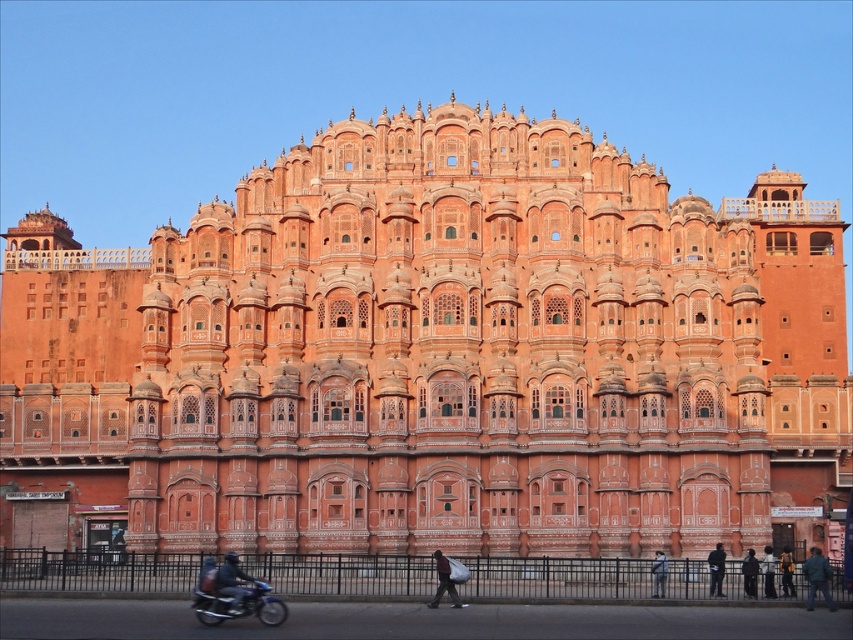
Can you confirm if shiny blue motorcycle at lower left is bigger than dark gray fabric bag at center?

Indeed, shiny blue motorcycle at lower left has a larger size compared to dark gray fabric bag at center.

Who is positioned more to the left, shiny blue motorcycle at lower left or dark gray fabric bag at center?

shiny blue motorcycle at lower left

Find the location of a particular element. This screenshot has width=853, height=640. shiny blue motorcycle at lower left is located at coordinates coord(233,595).

Which of these two, shiny blue motorcycle at lower left or dark blue fabric at lower right, stands taller?

shiny blue motorcycle at lower left is taller.

Between shiny blue motorcycle at lower left and dark blue fabric at lower right, which one is positioned higher?

Positioned higher is shiny blue motorcycle at lower left.

Does point (210, 621) lie behind point (753, 586)?

That is False.

What are the coordinates of `shiny blue motorcycle at lower left` in the screenshot? It's located at (233, 595).

Who is higher up, shiny blue motorcycle at lower left or dark blue jacket at lower right?

shiny blue motorcycle at lower left

Does shiny blue motorcycle at lower left have a greater width compared to dark blue jacket at lower right?

Correct, the width of shiny blue motorcycle at lower left exceeds that of dark blue jacket at lower right.

Does point (260, 588) come farther from viewer compared to point (810, 584)?

No, it is in front of (810, 584).

This screenshot has height=640, width=853. What are the coordinates of `shiny blue motorcycle at lower left` in the screenshot? It's located at (233, 595).